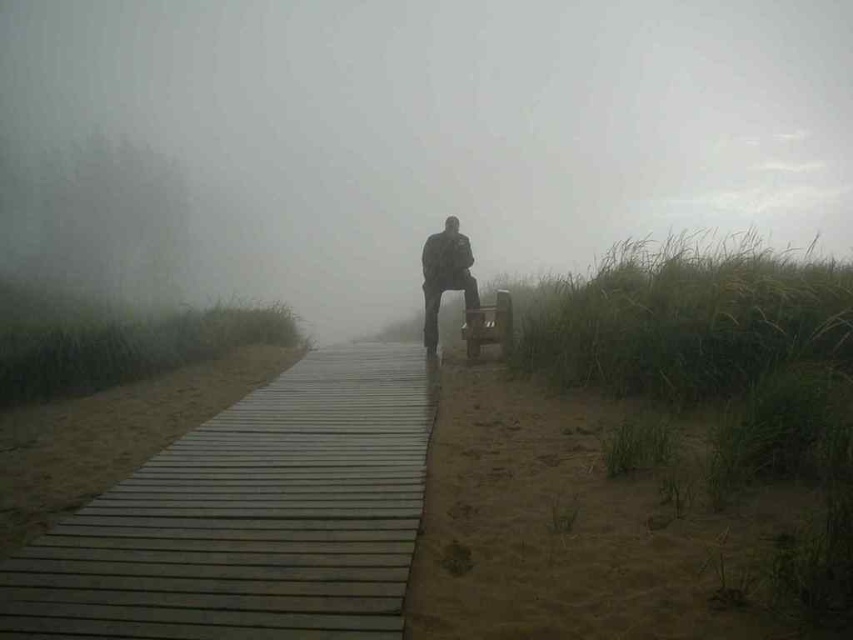
Question: Is foggy atmosphere at center positioned before wooden at center?

Choices:
 (A) yes
 (B) no

Answer: (B)

Question: Does foggy atmosphere at center appear on the left side of wooden at center?

Choices:
 (A) no
 (B) yes

Answer: (A)

Question: Does foggy atmosphere at center appear on the right side of wooden baby carriage at center?

Choices:
 (A) no
 (B) yes

Answer: (B)

Question: Which point is closer to the camera?

Choices:
 (A) (427, 237)
 (B) (486, 422)

Answer: (B)

Question: Which point is closer to the camera?

Choices:
 (A) foggy atmosphere at center
 (B) dark gray fabric jacket at center

Answer: (A)

Question: Which of the following is the closest to the observer?

Choices:
 (A) dark gray fabric jacket at center
 (B) wooden baby carriage at center

Answer: (B)